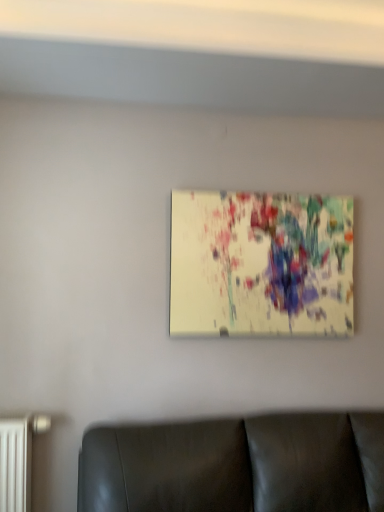
What do you see at coordinates (261, 264) in the screenshot? I see `matte canvas painting at center` at bounding box center [261, 264].

Measure the distance between point [259,228] and camera.

Point [259,228] is 2.09 meters from camera.

At what (x,y) coordinates should I click in order to perform the action: click on matte canvas painting at center. Please return your answer as a coordinate pair (x, y). This screenshot has height=512, width=384. Looking at the image, I should click on pos(261,264).

Describe the element at coordinates (236, 465) in the screenshot. I see `black leather couch at lower center` at that location.

The width and height of the screenshot is (384, 512). What are the coordinates of `black leather couch at lower center` in the screenshot? It's located at (236, 465).

Measure the distance between point [123,481] and camera.

Point [123,481] and camera are 5.55 feet apart from each other.

The height and width of the screenshot is (512, 384). What are the coordinates of `matte canvas painting at center` in the screenshot? It's located at (261, 264).

Considering the positions of objects matte canvas painting at center and black leather couch at lower center in the image provided, who is more to the left, matte canvas painting at center or black leather couch at lower center?

Positioned to the left is black leather couch at lower center.

Between matte canvas painting at center and black leather couch at lower center, which one is positioned in front?

black leather couch at lower center is more forward.

Does point (235, 245) lie in front of point (331, 421)?

No, (235, 245) is further to viewer.

From the image's perspective, is matte canvas painting at center beneath black leather couch at lower center?

Incorrect, from the image's perspective, matte canvas painting at center is higher than black leather couch at lower center.

From a real-world perspective, between matte canvas painting at center and black leather couch at lower center, who is vertically higher?

matte canvas painting at center.

Considering the sizes of objects matte canvas painting at center and black leather couch at lower center in the image provided, who is thinner, matte canvas painting at center or black leather couch at lower center?

With smaller width is matte canvas painting at center.

Does matte canvas painting at center have a lesser height compared to black leather couch at lower center?

No, matte canvas painting at center is not shorter than black leather couch at lower center.

Considering the sizes of objects matte canvas painting at center and black leather couch at lower center in the image provided, who is smaller, matte canvas painting at center or black leather couch at lower center?

matte canvas painting at center.

Is matte canvas painting at center not inside black leather couch at lower center?

Indeed, matte canvas painting at center is completely outside black leather couch at lower center.

From the picture: Would you consider matte canvas painting at center to be distant from black leather couch at lower center?

No.

Is matte canvas painting at center positioned with its back to black leather couch at lower center?

No, matte canvas painting at center's orientation is not away from black leather couch at lower center.

Locate an element on the screen. The width and height of the screenshot is (384, 512). picture frame above the black leather couch at lower center (from the image's perspective) is located at coordinates (261, 264).

Between black leather couch at lower center and matte canvas painting at center, which one appears on the right side from the viewer's perspective?

matte canvas painting at center.

Relative to matte canvas painting at center, is black leather couch at lower center in front or behind?

Clearly, black leather couch at lower center is in front of matte canvas painting at center.

Does point (243, 450) appear closer or farther from the camera than point (314, 226)?

Point (243, 450).

From the image's perspective, is black leather couch at lower center over matte canvas painting at center?

Incorrect, from the image's perspective, black leather couch at lower center is lower than matte canvas painting at center.

From a real-world perspective, is black leather couch at lower center above or below matte canvas painting at center?

From a real-world perspective, black leather couch at lower center is physically below matte canvas painting at center.

Is black leather couch at lower center wider than matte canvas painting at center?

Yes, black leather couch at lower center is wider than matte canvas painting at center.

Which of these two, black leather couch at lower center or matte canvas painting at center, stands taller?

matte canvas painting at center is taller.

From the picture: Which of these two, black leather couch at lower center or matte canvas painting at center, is smaller?

matte canvas painting at center.

Can we say black leather couch at lower center lies outside matte canvas painting at center?

Yes, black leather couch at lower center is not within matte canvas painting at center.

Is black leather couch at lower center in contact with matte canvas painting at center?

They are not placed beside each other.

Is black leather couch at lower center aimed at matte canvas painting at center?

No, black leather couch at lower center is not facing towards matte canvas painting at center.

How different are the orientations of black leather couch at lower center and matte canvas painting at center in degrees?

The angle between the facing direction of black leather couch at lower center and the facing direction of matte canvas painting at center is 0.215 degrees.

Measure the distance from black leather couch at lower center to matte canvas painting at center.

The distance of black leather couch at lower center from matte canvas painting at center is 26.11 inches.

The height and width of the screenshot is (512, 384). Identify the location of furniture in front of the matte canvas painting at center. (236, 465).

Find the location of a particular element. The width and height of the screenshot is (384, 512). picture frame behind the black leather couch at lower center is located at coordinates (261, 264).

Where is `furniture that appears below the matte canvas painting at center (from the image's perspective)`? furniture that appears below the matte canvas painting at center (from the image's perspective) is located at coordinates (236, 465).